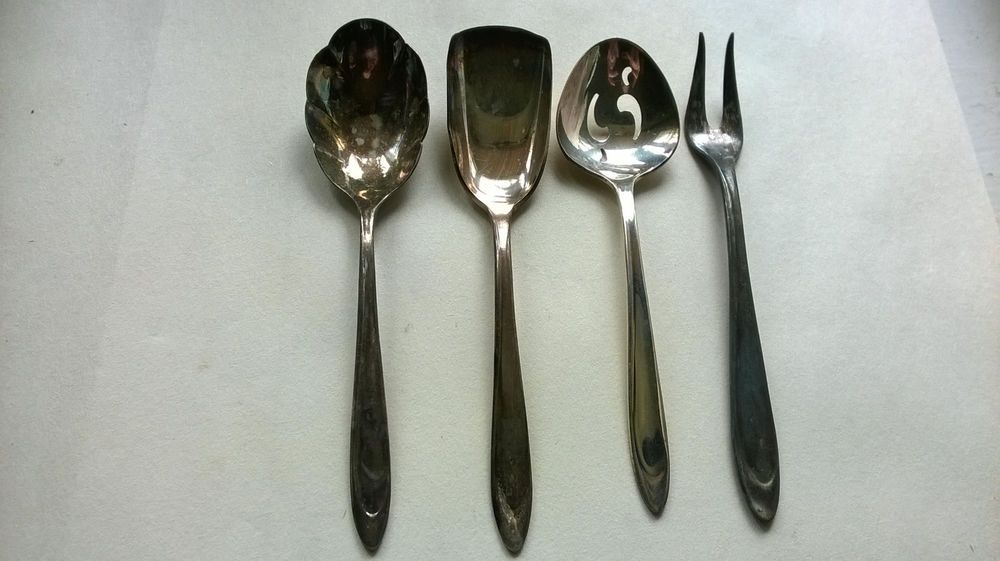
Where is `handle`? The width and height of the screenshot is (1000, 561). handle is located at coordinates (368, 456), (518, 452), (650, 439), (749, 426).